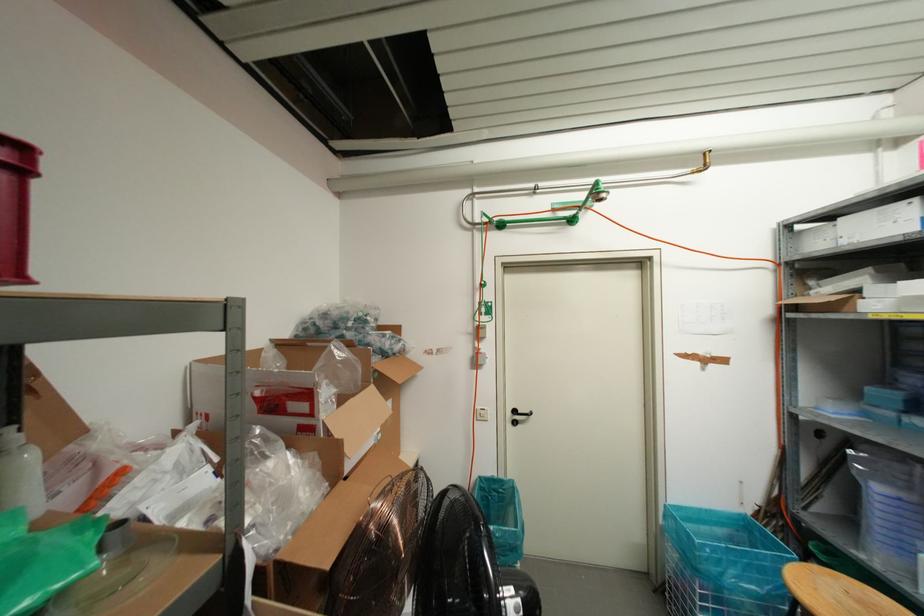
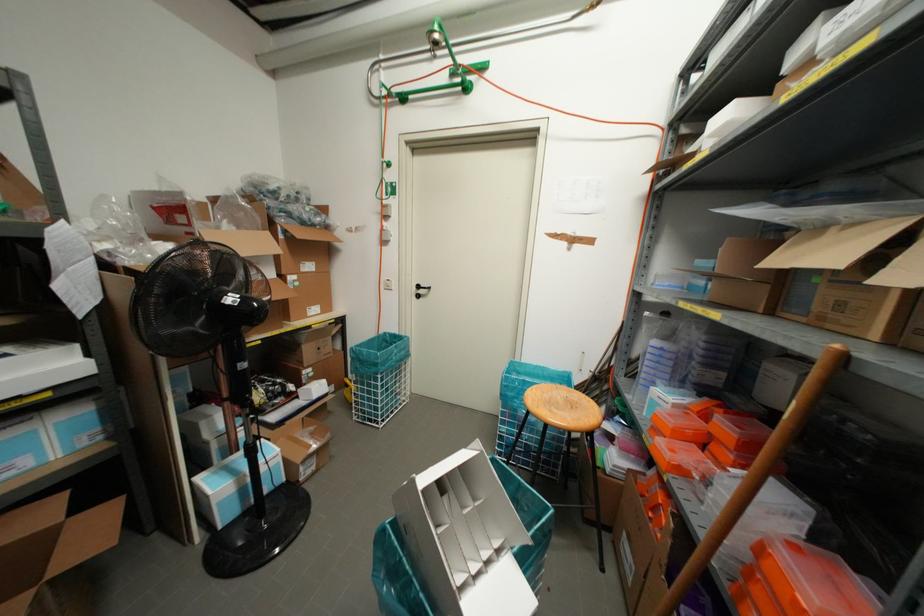
Find the pixel in the second image that matches point (517, 416) in the first image.

(419, 291)